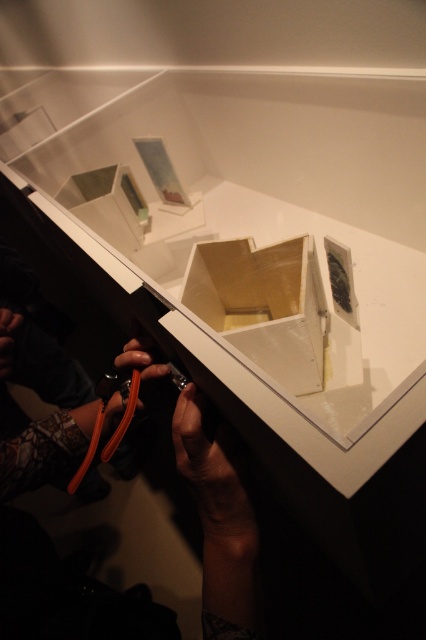
Question: Does orange rubber hose at lower left come behind white glossy box at center?

Choices:
 (A) yes
 (B) no

Answer: (B)

Question: Which point is closer to the camera?

Choices:
 (A) (278, 280)
 (B) (104, 616)
 (C) (134, 195)

Answer: (A)

Question: Is orange rubber hose at lower left smaller than white glossy box at center?

Choices:
 (A) yes
 (B) no

Answer: (B)

Question: Among these points, which one is farthest from the camera?

Choices:
 (A) (276, 340)
 (B) (118, 237)
 (C) (221, 598)

Answer: (B)

Question: Among these objects, which one is nearest to the camera?

Choices:
 (A) white glossy box at center
 (B) matte plastic box at upper left
 (C) orange rubber hose at lower left

Answer: (C)

Question: Where is white glossy box at center located in relation to matte plastic box at upper left in the image?

Choices:
 (A) left
 (B) right

Answer: (B)